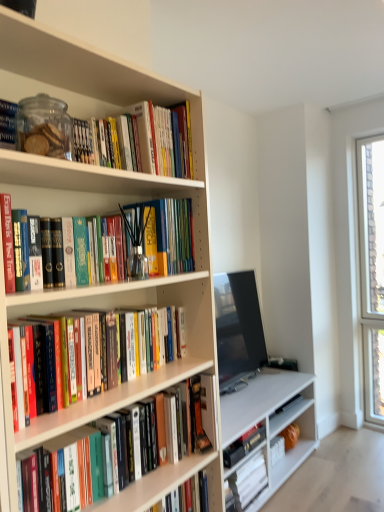
The width and height of the screenshot is (384, 512). What do you see at coordinates (186, 496) in the screenshot?
I see `hardcover book at lower center, which is the 5th book from top to bottom` at bounding box center [186, 496].

I want to click on hardcover book at lower center, which is counted as the seventh book, starting from the top, so click(x=249, y=480).

Image resolution: width=384 pixels, height=512 pixels. Identify the location of hardcover book at center, the fourth book in the bottom-to-top sequence. (102, 405).

Locate an element on the screen. hardcover books at upper left, the sixth book when ordered from bottom to top is located at coordinates (140, 241).

From the image's perspective, between hardcover books at center, positioned as the fifth book in bottom-to-top order, and white matte bookcase at left, who is located below?

hardcover books at center, positioned as the fifth book in bottom-to-top order, from the image's perspective.

From the image's perspective, which book is the 1st one below the white matte bookcase at left? Please provide its 2D coordinates.

[(111, 399)]

Considering the sizes of objects hardcover books at center, placed as the 3th book when sorted from top to bottom, and white matte bookcase at left in the image provided, who is taller, hardcover books at center, placed as the 3th book when sorted from top to bottom, or white matte bookcase at left?

Standing taller between the two is white matte bookcase at left.

How many degrees apart are the facing directions of hardcover book at center, the fourth book in the bottom-to-top sequence, and hardcover books at upper left, which is counted as the 2th book, starting from the top?

The angular difference between hardcover book at center, the fourth book in the bottom-to-top sequence, and hardcover books at upper left, which is counted as the 2th book, starting from the top, is 0.989 degrees.

Is hardcover book at center, the fourth book when ordered from top to bottom, closer to camera compared to hardcover books at upper left, the sixth book when ordered from bottom to top?

Yes, it is.

Visually, is hardcover book at center, the fourth book in the bottom-to-top sequence, positioned to the left or to the right of hardcover books at upper left, which is counted as the 2th book, starting from the top?

Clearly, hardcover book at center, the fourth book in the bottom-to-top sequence, is on the right of hardcover books at upper left, which is counted as the 2th book, starting from the top, in the image.

Considering the relative sizes of hardcover book at center, the fourth book when ordered from top to bottom, and hardcover books at upper left, the sixth book when ordered from bottom to top, in the image provided, is hardcover book at center, the fourth book when ordered from top to bottom, taller than hardcover books at upper left, the sixth book when ordered from bottom to top,?

Yes, hardcover book at center, the fourth book when ordered from top to bottom, is taller than hardcover books at upper left, the sixth book when ordered from bottom to top.

Can you confirm if hardcover books at upper left, the sixth book when ordered from bottom to top, is shorter than hardcover book at lower center, the first book from the bottom?

No.

From the image's perspective, is hardcover books at upper left, the sixth book when ordered from bottom to top, under hardcover book at lower center, the first book from the bottom?

Incorrect, from the image's perspective, hardcover books at upper left, the sixth book when ordered from bottom to top, is higher than hardcover book at lower center, the first book from the bottom.

There is a hardcover books at upper left, the sixth book when ordered from bottom to top. Where is `the 5th book below it (from the image's perspective)`? This screenshot has width=384, height=512. the 5th book below it (from the image's perspective) is located at coordinates (249, 480).

Can you confirm if hardcover books at upper left, which is counted as the 2th book, starting from the top, is thinner than hardcover book at lower center, which is counted as the seventh book, starting from the top?

No, hardcover books at upper left, which is counted as the 2th book, starting from the top, is not thinner than hardcover book at lower center, which is counted as the seventh book, starting from the top.

Is hardcover books at upper left, the sixth book when ordered from bottom to top, inside the boundaries of hardcover book at lower center, the 3th book positioned from the bottom, or outside?

hardcover books at upper left, the sixth book when ordered from bottom to top, cannot be found inside hardcover book at lower center, the 3th book positioned from the bottom.

Does hardcover books at upper left, the sixth book when ordered from bottom to top, have a greater height compared to hardcover book at lower center, which is the 5th book from top to bottom?

Yes, hardcover books at upper left, the sixth book when ordered from bottom to top, is taller than hardcover book at lower center, which is the 5th book from top to bottom.

In the scene shown: From the image's perspective, is hardcover books at upper left, which is counted as the 2th book, starting from the top, on top of hardcover book at lower center, the 3th book positioned from the bottom?

Yes, from the image's perspective, hardcover books at upper left, which is counted as the 2th book, starting from the top, is above hardcover book at lower center, the 3th book positioned from the bottom.

Is hardcover books at upper left, the sixth book when ordered from bottom to top, facing towards hardcover book at lower center, which is the 5th book from top to bottom?

No, hardcover books at upper left, the sixth book when ordered from bottom to top, does not turn towards hardcover book at lower center, which is the 5th book from top to bottom.

Which of these two, white matte bookcase at left or hardcover book at lower center, which is counted as the seventh book, starting from the top, is bigger?

Bigger between the two is white matte bookcase at left.

Based on the photo, is white matte bookcase at left far from hardcover book at lower center, which is counted as the seventh book, starting from the top?

white matte bookcase at left is far away from hardcover book at lower center, which is counted as the seventh book, starting from the top.

Considering the sizes of white matte bookcase at left and hardcover book at lower center, the first book from the bottom, in the image, is white matte bookcase at left wider or thinner than hardcover book at lower center, the first book from the bottom,?

Considering their sizes, white matte bookcase at left looks broader than hardcover book at lower center, the first book from the bottom.

Based on the photo, can you tell me how much white matte bookcase at left and hardcover book at lower center, the first book from the bottom, differ in facing direction?

The angle between the facing direction of white matte bookcase at left and the facing direction of hardcover book at lower center, the first book from the bottom, is 0.413 degrees.

From the image's perspective, which book is the 2nd one above the hardcover book at lower center, placed as the 2th book when sorted from bottom to top? Please provide its 2D coordinates.

[(102, 405)]

From a real-world perspective, does hardcover book at lower center, which is the sixth book in top-to-bottom order, sit lower than hardcover book at center, the fourth book in the bottom-to-top sequence?

Yes, from a real-world perspective, hardcover book at lower center, which is the sixth book in top-to-bottom order, is beneath hardcover book at center, the fourth book in the bottom-to-top sequence.

Is hardcover book at lower center, which is the sixth book in top-to-bottom order, inside the boundaries of hardcover book at center, the fourth book in the bottom-to-top sequence, or outside?

hardcover book at lower center, which is the sixth book in top-to-bottom order, is not inside hardcover book at center, the fourth book in the bottom-to-top sequence, it's outside.

From a real-world perspective, is hardcover book at center, the fourth book in the bottom-to-top sequence, on hardcover book at lower center, placed as the 2th book when sorted from bottom to top?

Yes, from a real-world perspective, hardcover book at center, the fourth book in the bottom-to-top sequence, is on top of hardcover book at lower center, placed as the 2th book when sorted from bottom to top.

Are hardcover book at center, the fourth book when ordered from top to bottom, and hardcover book at lower center, placed as the 2th book when sorted from bottom to top, located far from each other?

No, hardcover book at center, the fourth book when ordered from top to bottom, is in close proximity to hardcover book at lower center, placed as the 2th book when sorted from bottom to top.

Which object is positioned more to the left, hardcover book at center, the fourth book in the bottom-to-top sequence, or hardcover book at lower center, placed as the 2th book when sorted from bottom to top?

hardcover book at center, the fourth book in the bottom-to-top sequence.

From the image's perspective, count 1st books downward from the white matte bookcase at left and point to it. Please provide its 2D coordinates.

[(111, 399)]

Identify the location of the 1st book behind the hardcover book at center, the fourth book when ordered from top to bottom. (140, 241).

Which object lies nearer to the anchor point hardcover book at lower center, the 3th book positioned from the bottom, matte black tv at center or hardcover books at upper left, which is counted as the 2th book, starting from the top?

hardcover books at upper left, which is counted as the 2th book, starting from the top, lies closer to hardcover book at lower center, the 3th book positioned from the bottom, than the other object.

Estimate the real-world distances between objects in this image. Which object is further from hardcover book at lower center, the 3th book positioned from the bottom, matte glass jar at upper left, which ranks as the seventh book in bottom-to-top order, or hardcover books at center, placed as the 3th book when sorted from top to bottom?

matte glass jar at upper left, which ranks as the seventh book in bottom-to-top order, is positioned further to the anchor hardcover book at lower center, the 3th book positioned from the bottom.

When comparing their distances from hardcover book at lower center, the 3th book positioned from the bottom, does hardcover book at lower center, which is counted as the seventh book, starting from the top, or hardcover book at center, the fourth book in the bottom-to-top sequence, seem closer?

hardcover book at center, the fourth book in the bottom-to-top sequence, is closer to hardcover book at lower center, the 3th book positioned from the bottom.

Estimate the real-world distances between objects in this image. Which object is further from matte glass jar at upper left, positioned as the 1th book in top-to-bottom order, hardcover book at lower center, the 3th book positioned from the bottom, or hardcover book at lower center, placed as the 2th book when sorted from bottom to top?

Among the two, hardcover book at lower center, placed as the 2th book when sorted from bottom to top, is located further to matte glass jar at upper left, positioned as the 1th book in top-to-bottom order.

Considering their positions, is hardcover book at lower center, which is counted as the seventh book, starting from the top, positioned closer to hardcover books at center, placed as the 3th book when sorted from top to bottom, than hardcover book at center, the fourth book when ordered from top to bottom?

Based on the image, hardcover book at center, the fourth book when ordered from top to bottom, appears to be nearer to hardcover books at center, placed as the 3th book when sorted from top to bottom.

Considering their positions, is white matte bookcase at left positioned closer to hardcover books at center, positioned as the fifth book in bottom-to-top order, than hardcover book at center, the fourth book in the bottom-to-top sequence?

hardcover book at center, the fourth book in the bottom-to-top sequence, is positioned closer to the anchor hardcover books at center, positioned as the fifth book in bottom-to-top order.

Estimate the real-world distances between objects in this image. Which object is further from hardcover books at center, placed as the 3th book when sorted from top to bottom, hardcover books at upper left, which is counted as the 2th book, starting from the top, or matte glass jar at upper left, which ranks as the seventh book in bottom-to-top order?

matte glass jar at upper left, which ranks as the seventh book in bottom-to-top order, is further to hardcover books at center, placed as the 3th book when sorted from top to bottom.

Looking at the image, which one is located closer to hardcover book at lower center, the first book from the bottom, hardcover books at upper left, the sixth book when ordered from bottom to top, or hardcover book at center, the fourth book in the bottom-to-top sequence?

Among the two, hardcover book at center, the fourth book in the bottom-to-top sequence, is located nearer to hardcover book at lower center, the first book from the bottom.

Locate an element on the screen. bookcase between matte glass jar at upper left, which ranks as the seventh book in bottom-to-top order, and hardcover book at lower center, the first book from the bottom, vertically is located at coordinates (101, 212).

I want to click on bookcase between matte glass jar at upper left, positioned as the 1th book in top-to-bottom order, and hardcover book at lower center, which is the 5th book from top to bottom, in the vertical direction, so click(101, 212).

Find the location of a particular element. bookcase between hardcover books at upper left, which is counted as the 2th book, starting from the top, and hardcover books at center, placed as the 3th book when sorted from top to bottom, from top to bottom is located at coordinates (101, 212).

Find the location of `television between matte glass jar at upper left, positioned as the 1th book in top-to-bottom order, and hardcover book at lower center, the first book from the bottom, in the vertical direction`. television between matte glass jar at upper left, positioned as the 1th book in top-to-bottom order, and hardcover book at lower center, the first book from the bottom, in the vertical direction is located at coordinates (238, 326).